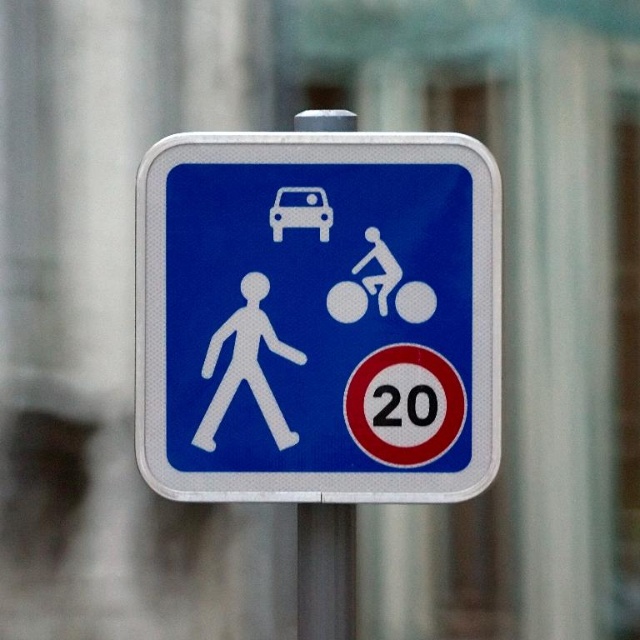
You are a photographer adjusting your camera settings to capture the silver metallic pole at center and the white matte pedestrian at center. Which object should you focus on if you want the larger object to be in sharp focus?

The silver metallic pole at center is larger in size than the white matte pedestrian at center, so you should focus on the silver metallic pole at center to ensure it is in sharp focus.

You are driving a car and approaching a blue metallic sign at center mounted on a silver metallic pole at center. According to the image description, which object is located above the other?

The blue metallic sign at center is positioned over silver metallic pole at center, so the blue metallic sign at center is above the silver metallic pole at center.

You are driving a car and see the blue metallic sign at center and the white plastic car at upper center in your view. Which object is positioned higher up in your field of view?

The white plastic car at upper center is positioned higher up in your field of view because it is above the blue metallic sign at center.